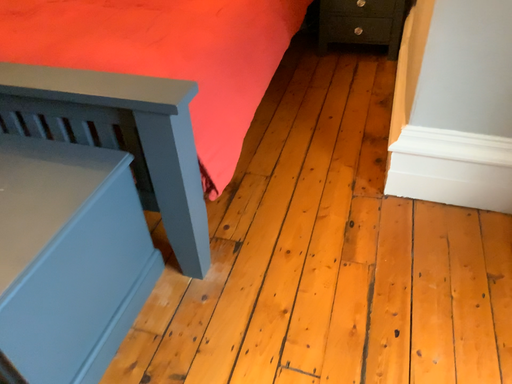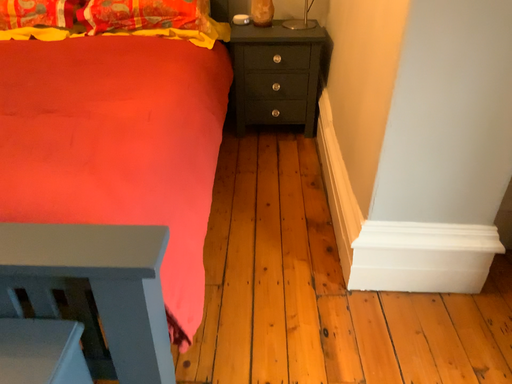
Question: How did the camera likely rotate when shooting the video?

Choices:
 (A) rotated upward
 (B) rotated downward

Answer: (A)